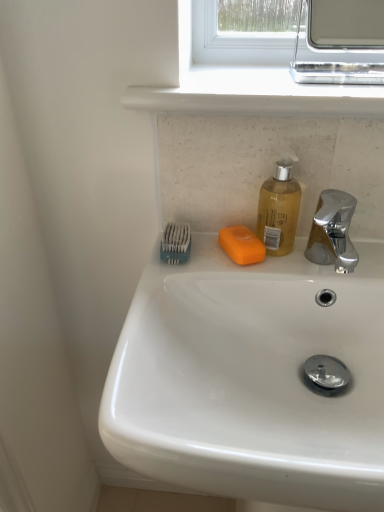
Locate an element on the screen. empty space that is ontop of white smooth window sill at upper center is located at coordinates (266, 71).